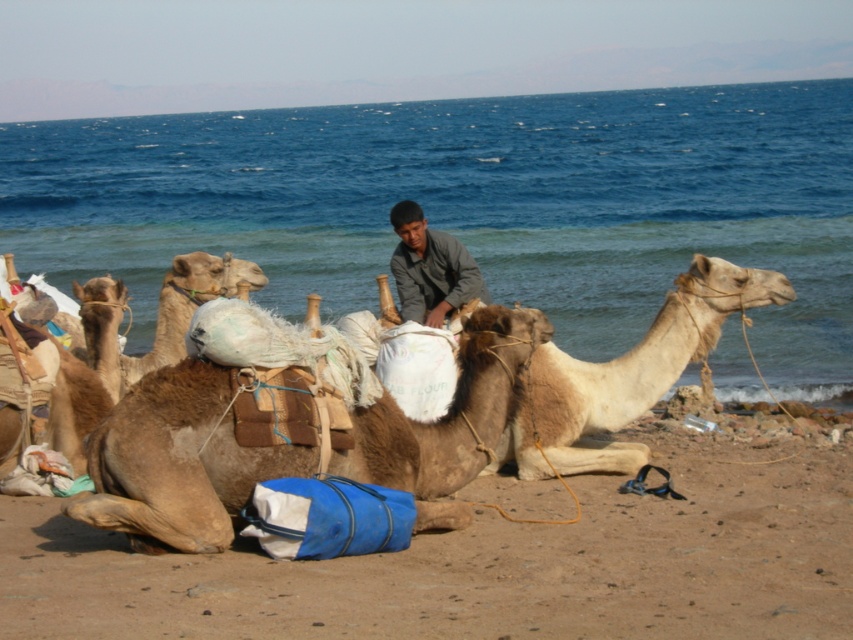
You are a photographer standing at the edge of the beach. You want to take a photo of the brown sandy ground at lower center and the brown rough camel at center. Which object appears wider in the photo?

The brown sandy ground at lower center appears wider than the brown rough camel at center because its width surpasses the camel.

You are standing at the point marked by the coordinates point (489, 563). What is the surface you are standing on?

The surface you are standing on is the brown sandy ground at lower center, as indicated by the coordinates point (489, 563).

You are standing at the point marked by coordinates point [625,374]. Describe what you see directly in front of you.

The point [625,374] marks fuzzy beige camel at center, so directly in front of you is the fuzzy beige camel at center.